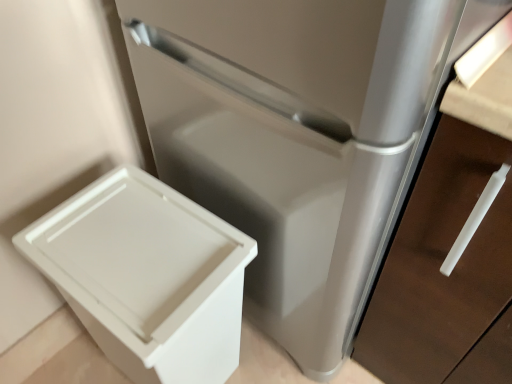
Locate an element on the screen. Image resolution: width=512 pixels, height=384 pixels. vacant space situated above white plastic bin at lower left (from a real-world perspective) is located at coordinates (x=130, y=235).